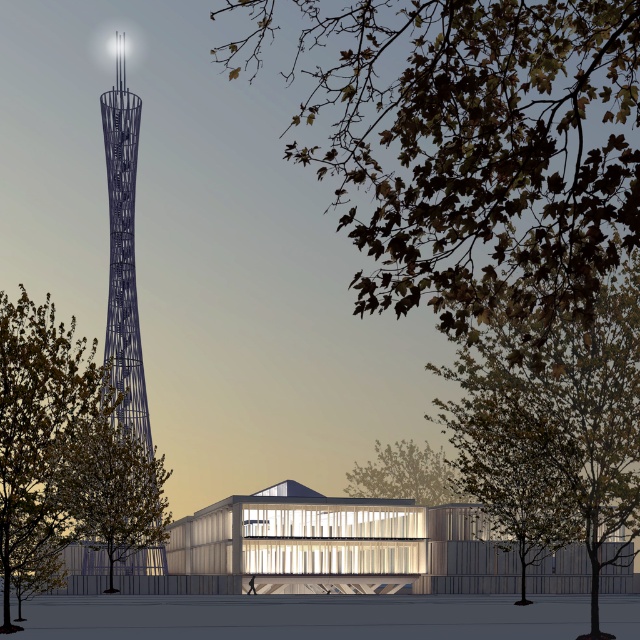
Between green leafy tree at right and metallic lattice tower at left, which one has more height?

metallic lattice tower at left

Which of these two, green leafy tree at right or metallic lattice tower at left, stands shorter?

With less height is green leafy tree at right.

Is point (616, 413) in front of point (129, 108)?

That is True.

Locate an element on the screen. This screenshot has width=640, height=640. green leafy tree at right is located at coordinates (556, 429).

Looking at this image, is green leafy tree at left smaller than green leafy tree at center?

Actually, green leafy tree at left might be larger than green leafy tree at center.

Is point (28, 378) farther from camera compared to point (388, 483)?

That is False.

Identify the location of green leafy tree at left. The image size is (640, 640). (65, 456).

Who is more distant from viewer, (1, 321) or (81, 477)?

Point (81, 477)

At what (x,y) coordinates should I click in order to perform the action: click on green leafy tree at left. Please return your answer as a coordinate pair (x, y). The image size is (640, 640). Looking at the image, I should click on (65, 456).

This screenshot has width=640, height=640. I want to click on green leafy tree at left, so click(x=65, y=456).